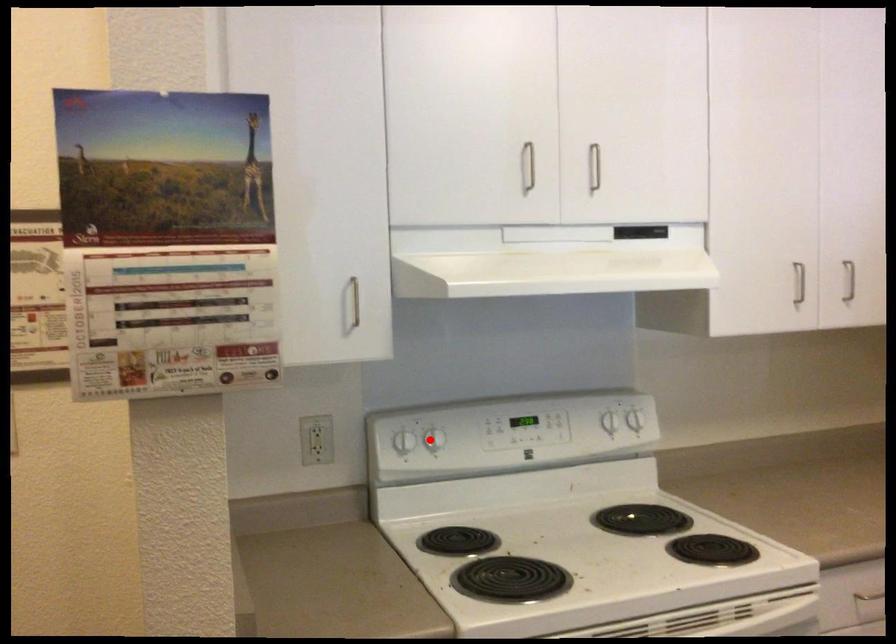
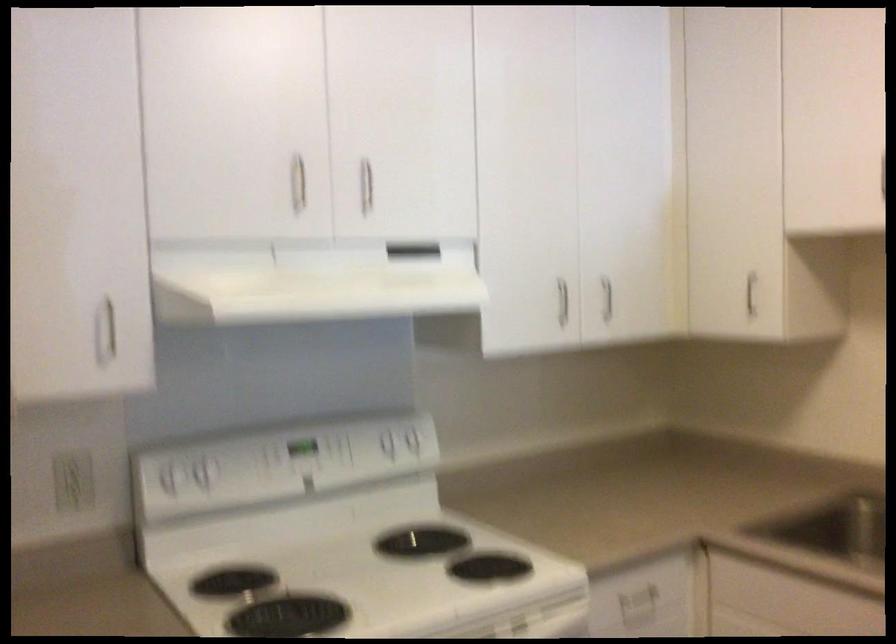
In the second image, find the point that corresponds to the highlighted location in the first image.

(200, 474)